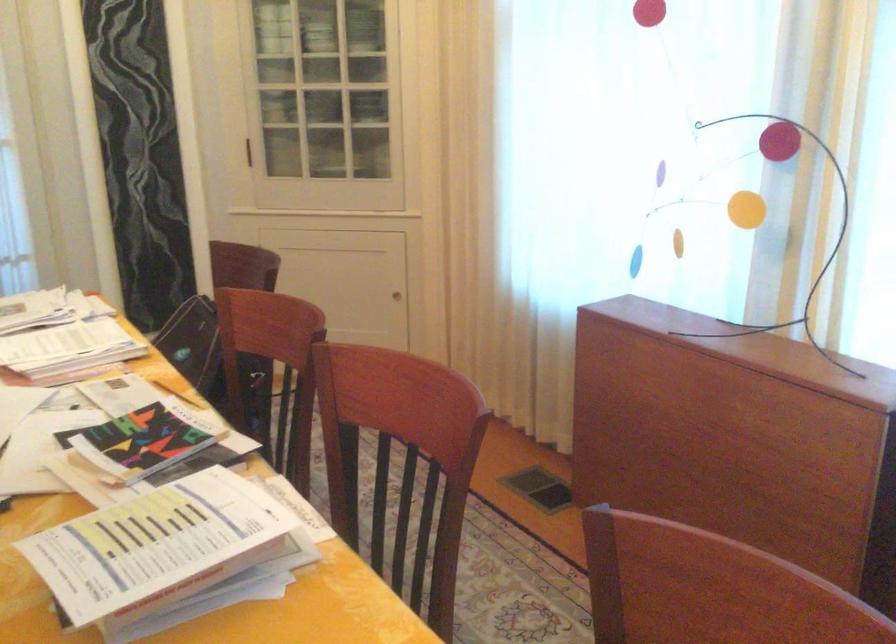
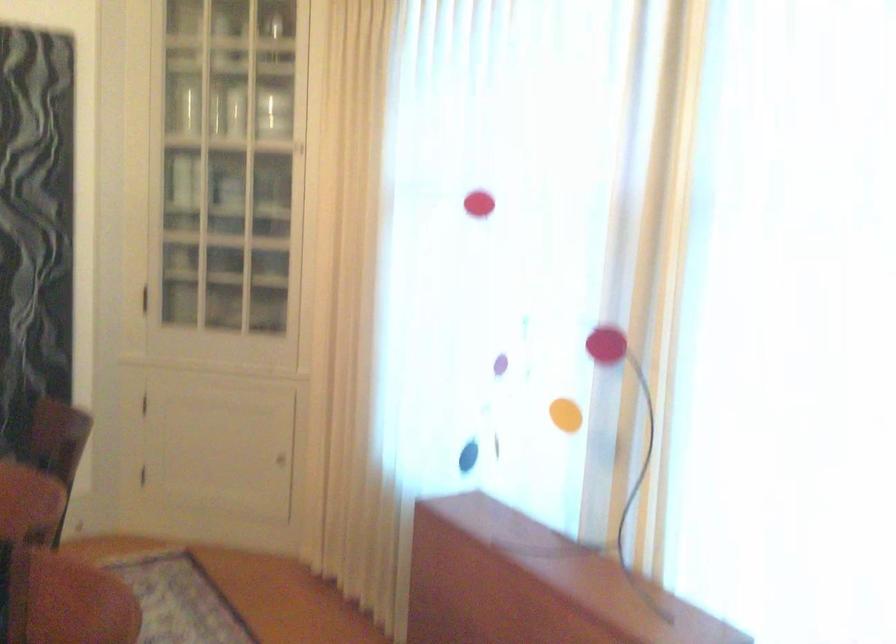
The point at (394,299) is marked in the first image. Where is the corresponding point in the second image?

(280, 460)